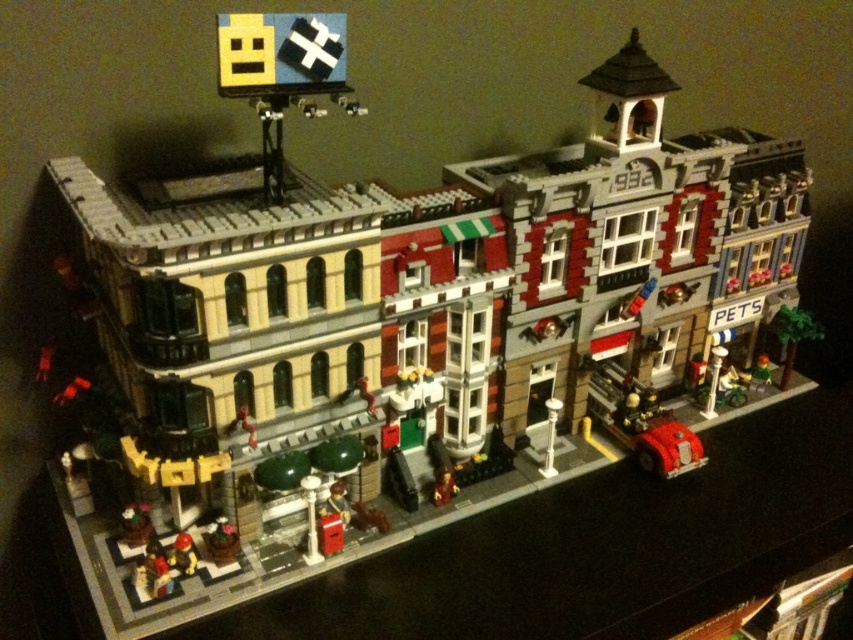
Who is more distant from viewer, (183, 561) or (448, 493)?

The point (448, 493) is more distant.

Measure the distance between point (177,563) and camera.

Point (177,563) is 3.60 feet away from camera.

Where is `brick-like figure at lower left`? The image size is (853, 640). brick-like figure at lower left is located at coordinates (183, 554).